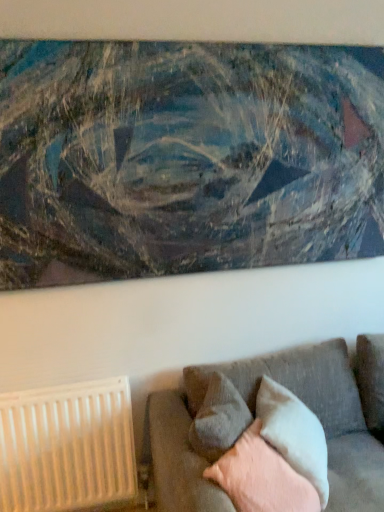
Question: Based on their positions, is gray fabric pillow at lower center, which is the 2th pillow in back-to-front order, located to the left or right of light gray fabric pillow at lower right, which ranks as the first pillow in back-to-front order?

Choices:
 (A) right
 (B) left

Answer: (B)

Question: From the image's perspective, is gray fabric pillow at lower center, which is the 2th pillow in back-to-front order, located above or below light gray fabric pillow at lower right, which ranks as the first pillow in back-to-front order?

Choices:
 (A) below
 (B) above

Answer: (B)

Question: Estimate the real-world distances between objects in this image. Which object is closer to the white plastic radiator at lower left?

Choices:
 (A) soft gray cushion at lower right, arranged as the first pillow when viewed from the front
 (B) textured gray couch at lower right
 (C) gray fabric pillow at lower center, positioned as the 2th pillow in front-to-back order
 (D) light gray fabric pillow at lower right, which ranks as the first pillow in back-to-front order
 (E) textured canvas painting at upper center

Answer: (B)

Question: Considering the real-world distances, which object is farthest from the gray fabric pillow at lower center, which is the 2th pillow in back-to-front order?

Choices:
 (A) textured gray couch at lower right
 (B) textured canvas painting at upper center
 (C) light gray fabric pillow at lower right, which ranks as the first pillow in back-to-front order
 (D) white plastic radiator at lower left
 (E) soft gray cushion at lower right, which is the 3th pillow from back to front

Answer: (B)